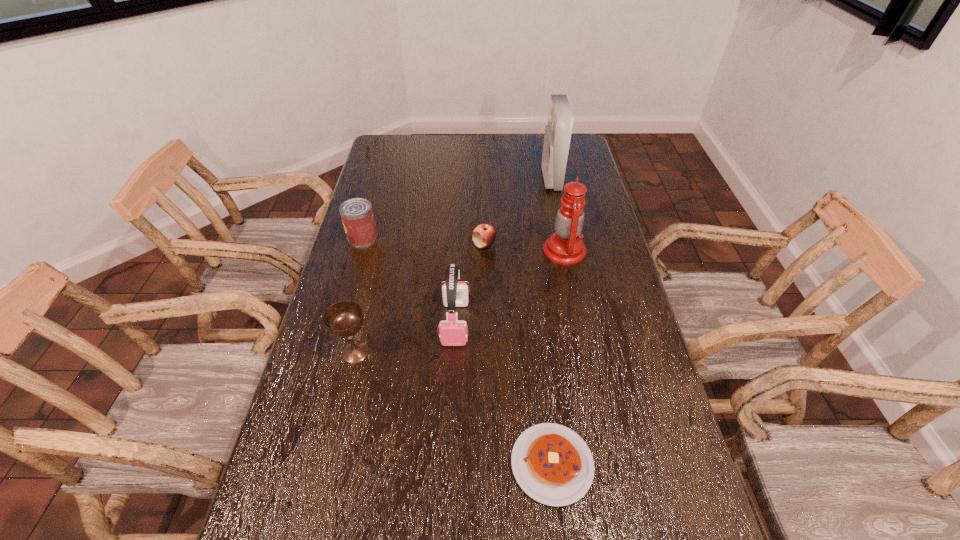
Locate an element on the screen. The image size is (960, 540). the first-aid kit is located at coordinates (557, 136).

Locate an element on the screen. oil lamp is located at coordinates (565, 246).

Find the location of a particular element. The width and height of the screenshot is (960, 540). the third object from left to right is located at coordinates click(452, 332).

This screenshot has width=960, height=540. Identify the location of earphone. point(452,332).

Identify the location of chalice. (344, 319).

Where is `the third shortest object`? The image size is (960, 540). the third shortest object is located at coordinates (357, 216).

Locate an element on the screen. The height and width of the screenshot is (540, 960). the second shortest object is located at coordinates (484, 235).

You are a GUI agent. You are given a task and a screenshot of the screen. Output one action in this format:
    pyautogui.click(x=<x>, y=<y>)
    Task: Click on the fourth object from right to left
    This screenshot has width=960, height=540.
    Given the screenshot: What is the action you would take?
    pyautogui.click(x=484, y=235)

The width and height of the screenshot is (960, 540). In order to click on the nearest object in this screenshot , I will do `click(552, 464)`.

I want to click on the shortest object, so click(552, 464).